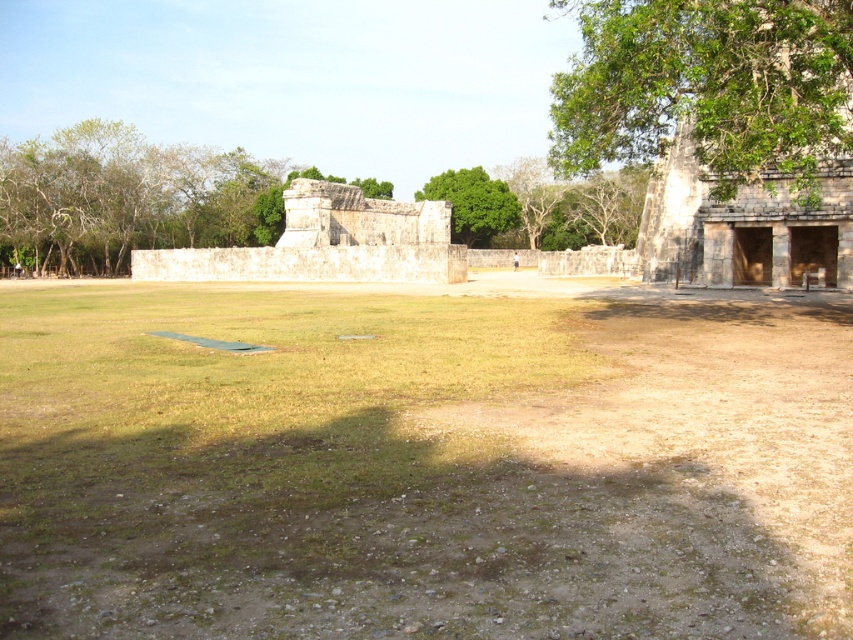
You are standing in the courtyard and want to find the tallest tree to rest under. Which tree should you choose between the green leafy tree at upper right and the green leafy tree at center?

The green leafy tree at upper right is taller than the green leafy tree at center, so you should choose the green leafy tree at upper right to rest under.

You are standing at the center of the courtyard and see the point marked at coordinate (709, 86). Which direction should you walk to reach the green leafy tree at upper right?

The point at coordinate (709, 86) is on the green leafy tree at upper right, so you should walk towards the upper right direction to reach it.